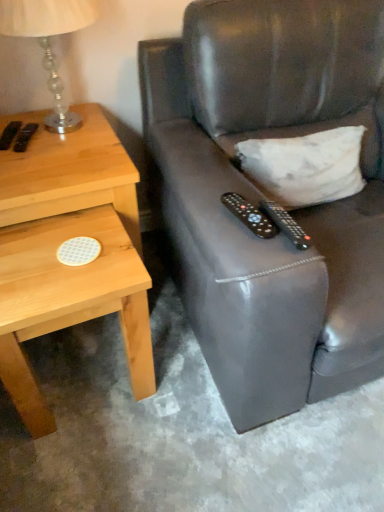
Question: Is black plastic remote control at center, which is the 1th remote control in left-to-right order, further to camera compared to light wood/texture nightstand at left?

Choices:
 (A) no
 (B) yes

Answer: (A)

Question: Does black plastic remote control at center, which is the 1th remote control in left-to-right order, have a smaller size compared to light wood/texture nightstand at left?

Choices:
 (A) no
 (B) yes

Answer: (B)

Question: Is black plastic remote control at center, which ranks as the second remote control in right-to-left order, at the left side of light wood/texture nightstand at left?

Choices:
 (A) yes
 (B) no

Answer: (B)

Question: Is black plastic remote control at center, which is the 1th remote control in left-to-right order, bigger than light wood/texture nightstand at left?

Choices:
 (A) no
 (B) yes

Answer: (A)

Question: Is light wood/texture nightstand at left inside black plastic remote control at center, which is the 1th remote control in left-to-right order?

Choices:
 (A) no
 (B) yes

Answer: (A)

Question: Does black plastic remote control at center, which is the 1th remote control in left-to-right order, have a lesser height compared to light wood/texture nightstand at left?

Choices:
 (A) no
 (B) yes

Answer: (B)

Question: Is leather couch at right facing away from light wood/texture nightstand at left?

Choices:
 (A) no
 (B) yes

Answer: (A)

Question: Is leather couch at right at the left side of light wood/texture nightstand at left?

Choices:
 (A) yes
 (B) no

Answer: (B)

Question: Is leather couch at right to the right of light wood/texture nightstand at left from the viewer's perspective?

Choices:
 (A) yes
 (B) no

Answer: (A)

Question: Is leather couch at right taller than light wood/texture nightstand at left?

Choices:
 (A) yes
 (B) no

Answer: (A)

Question: Does leather couch at right touch light wood/texture nightstand at left?

Choices:
 (A) yes
 (B) no

Answer: (B)

Question: Is leather couch at right behind light wood/texture nightstand at left?

Choices:
 (A) yes
 (B) no

Answer: (B)

Question: Is white matte pillow at upper right touching light wood/texture nightstand at left?

Choices:
 (A) yes
 (B) no

Answer: (B)